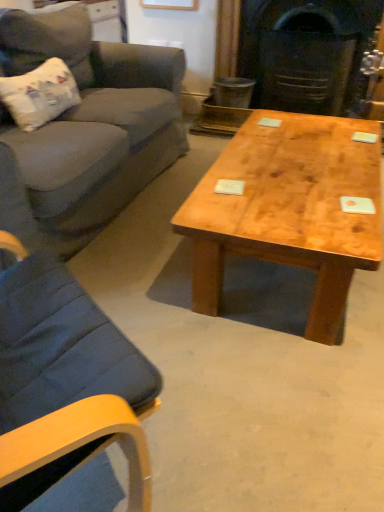
Image resolution: width=384 pixels, height=512 pixels. Find the location of `vacant space that is to the left of natural wood coffee table at center`. vacant space that is to the left of natural wood coffee table at center is located at coordinates (142, 248).